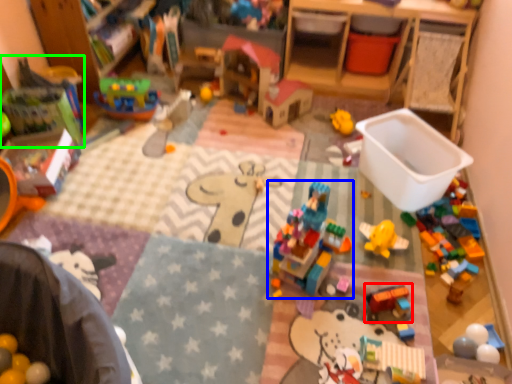
Question: Which object is the closest to the toy (highlighted by a red box)? Choose among these: toy (highlighted by a blue box) or toy (highlighted by a green box).

Choices:
 (A) toy
 (B) toy

Answer: (A)